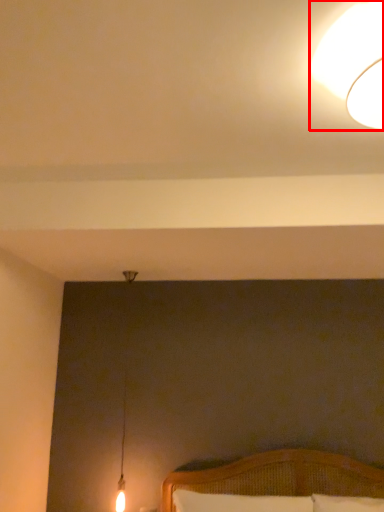
Question: From the image's perspective, what is the correct spatial relationship of lamp (annotated by the red box) in relation to pillow?

Choices:
 (A) above
 (B) below

Answer: (A)